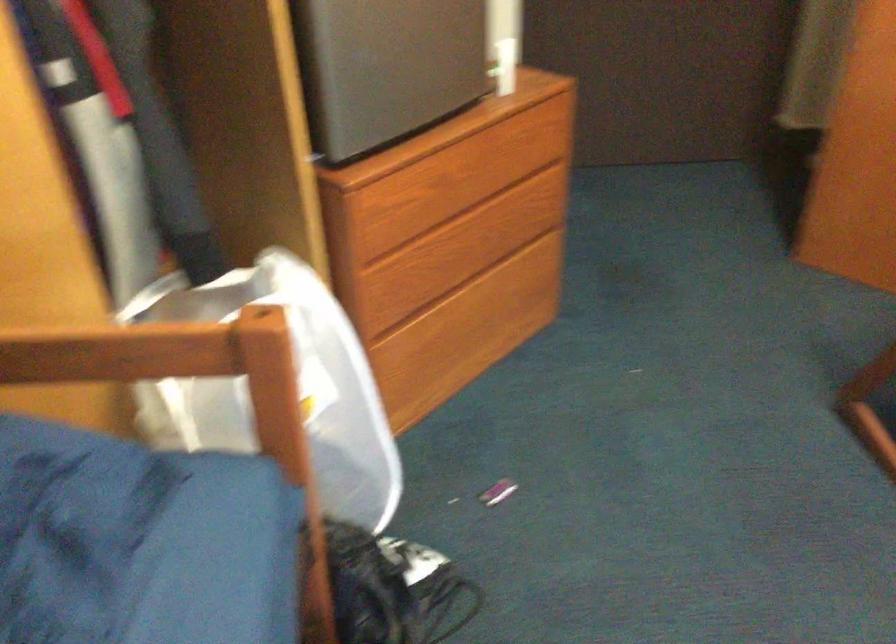
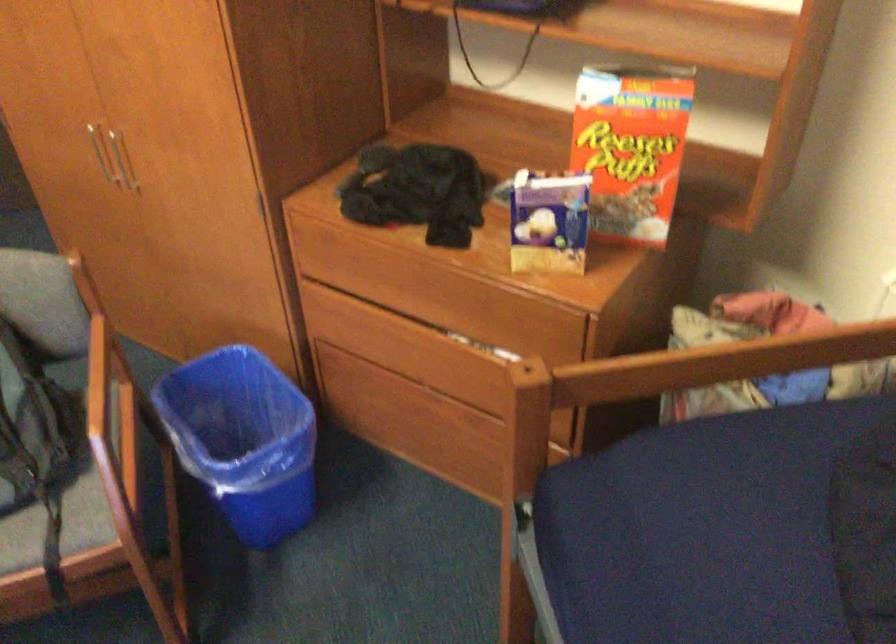
Question: The images are taken continuously from a first-person perspective. In which direction are you moving?

Choices:
 (A) Left
 (B) Right
 (C) Forward
 (D) Backward

Answer: (B)